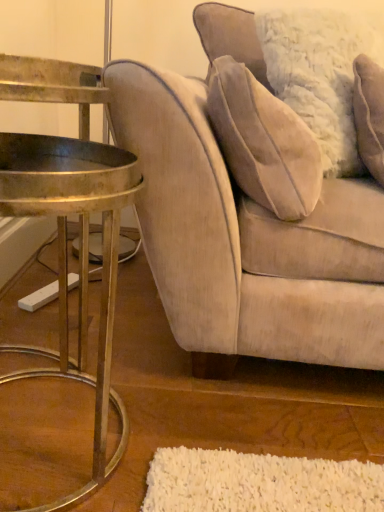
What are the coordinates of `gold metallic table at left` in the screenshot? It's located at (80, 257).

This screenshot has height=512, width=384. I want to click on velvet beige couch at right, so click(246, 240).

What do you see at coordinates (246, 240) in the screenshot? Image resolution: width=384 pixels, height=512 pixels. I see `velvet beige couch at right` at bounding box center [246, 240].

Locate an element on the screen. gold metallic table at left is located at coordinates (80, 257).

Which of these two, velvet beige pillow at upper right or gold metallic table at left, is thinner?

velvet beige pillow at upper right is thinner.

Is gold metallic table at left located within velvet beige pillow at upper right?

No, gold metallic table at left is not surrounded by velvet beige pillow at upper right.

Locate an element on the screen. This screenshot has width=384, height=512. pillow behind the gold metallic table at left is located at coordinates (320, 74).

Which of these two, velvet beige pillow at upper right or gold metallic table at left, is bigger?

With larger size is velvet beige pillow at upper right.

Is point (382, 355) positioned before point (123, 151)?

No, (382, 355) is further to viewer.

Is velvet beige couch at right to the left of gold metallic table at left from the viewer's perspective?

In fact, velvet beige couch at right is to the right of gold metallic table at left.

Looking at the image, does velvet beige couch at right seem bigger or smaller compared to gold metallic table at left?

Clearly, velvet beige couch at right is larger in size than gold metallic table at left.

Between velvet beige couch at right and gold metallic table at left, which one has larger width?

velvet beige couch at right.

Is gold metallic table at left touching velvet beige couch at right?

No.

Can you confirm if gold metallic table at left is bigger than velvet beige couch at right?

No.

From a real-world perspective, is gold metallic table at left located higher than velvet beige couch at right?

No, from a real-world perspective, gold metallic table at left is not above velvet beige couch at right.

Which object is thinner, gold metallic table at left or velvet beige pillow at upper right?

Thinner between the two is velvet beige pillow at upper right.

From the picture: From the image's perspective, is gold metallic table at left positioned above or below velvet beige pillow at upper right?

gold metallic table at left is below velvet beige pillow at upper right.

Which object is positioned more to the left, gold metallic table at left or velvet beige pillow at upper right?

Positioned to the left is gold metallic table at left.

At what (x,y) coordinates should I click in order to perform the action: click on pillow lying above the gold metallic table at left (from the image's perspective). Please return your answer as a coordinate pair (x, y). The height and width of the screenshot is (512, 384). Looking at the image, I should click on (320, 74).

Which object is closer to the camera, velvet beige couch at right or velvet beige pillow at upper right?

velvet beige couch at right is more forward.

Is velvet beige couch at right to the left or to the right of velvet beige pillow at upper right in the image?

A: Based on their positions, velvet beige couch at right is located to the left of velvet beige pillow at upper right.

Is velvet beige couch at right not within velvet beige pillow at upper right?

velvet beige couch at right lies outside velvet beige pillow at upper right's area.

Is velvet beige couch at right at the back of velvet beige pillow at upper right?

Yes, velvet beige pillow at upper right's orientation is away from velvet beige couch at right.

Locate an element on the screen. studio couch below the velvet beige pillow at upper right (from a real-world perspective) is located at coordinates (246, 240).

Is velvet beige pillow at upper right shorter than velvet beige couch at right?

Indeed, velvet beige pillow at upper right has a lesser height compared to velvet beige couch at right.

Locate an element on the screen. This screenshot has height=512, width=384. pillow behind the gold metallic table at left is located at coordinates (320, 74).

This screenshot has height=512, width=384. Identify the location of table that appears in front of the velvet beige couch at right. (80, 257).

Considering their positions, is velvet beige pillow at upper right positioned closer to gold metallic table at left than velvet beige couch at right?

The object closer to gold metallic table at left is velvet beige couch at right.

Looking at the image, which one is located further to velvet beige couch at right, gold metallic table at left or velvet beige pillow at upper right?

Among the two, velvet beige pillow at upper right is located further to velvet beige couch at right.

Considering their positions, is velvet beige couch at right positioned further to velvet beige pillow at upper right than gold metallic table at left?

gold metallic table at left.

Considering their positions, is gold metallic table at left positioned closer to velvet beige pillow at upper right than velvet beige couch at right?

Based on the image, velvet beige couch at right appears to be nearer to velvet beige pillow at upper right.

Estimate the real-world distances between objects in this image. Which object is closer to velvet beige couch at right, velvet beige pillow at upper right or gold metallic table at left?

gold metallic table at left is closer to velvet beige couch at right.

Looking at the image, which one is located further to gold metallic table at left, velvet beige couch at right or velvet beige pillow at upper right?

velvet beige pillow at upper right is further to gold metallic table at left.

Locate an element on the screen. studio couch between gold metallic table at left and velvet beige pillow at upper right in the horizontal direction is located at coordinates (246, 240).